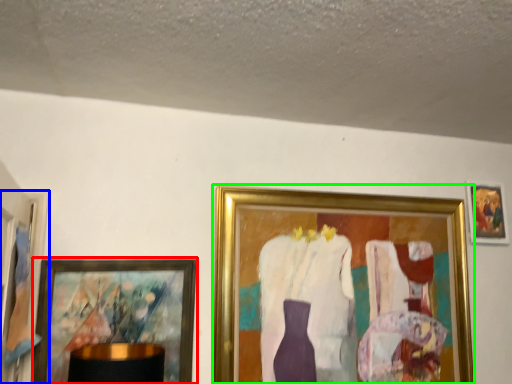
Question: Which object is the farthest from picture frame (highlighted by a red box)? Choose among these: picture frame (highlighted by a blue box) or picture frame (highlighted by a green box).

Choices:
 (A) picture frame
 (B) picture frame

Answer: (B)